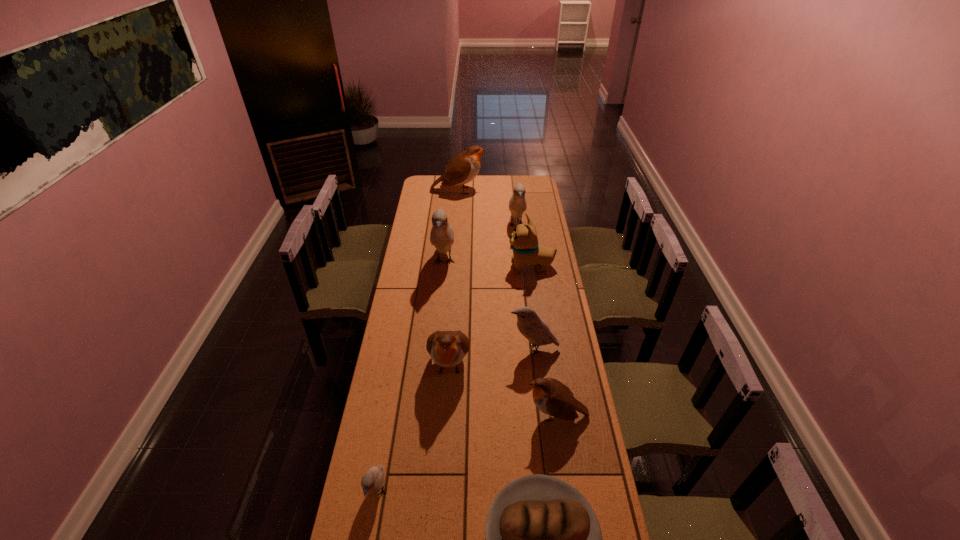
The image size is (960, 540). In the image, there is a desktop. What are the coordinates of `free space at the right edge` in the screenshot? It's located at (546, 361).

At what (x,y) coordinates should I click in order to perform the action: click on free space between the farthest brown bird and the nearest brown bird. Please return your answer as a coordinate pair (x, y). Looking at the image, I should click on (507, 303).

The width and height of the screenshot is (960, 540). Identify the location of unoccupied area between the third farthest white bird and the farthest object. (496, 269).

Identify the location of vacant region between the puppy and the farthest object. The width and height of the screenshot is (960, 540). (494, 228).

Identify the location of free space between the puppy and the nearest white bird. (454, 380).

Locate an element on the screen. Image resolution: width=960 pixels, height=540 pixels. blank region between the puppy and the nearest white bird is located at coordinates (454, 380).

Find the location of a particular element. free spot between the third farthest white bird and the eighth nearest object is located at coordinates (525, 287).

This screenshot has height=540, width=960. In order to click on object that is the fifth nearest to the second nearest white bird in this screenshot , I will do `click(543, 539)`.

Locate an element on the screen. This screenshot has height=540, width=960. object that is the seventh closest to the second smallest white bird is located at coordinates (517, 205).

Identify which bird is located as the third nearest to the second smallest brown bird. Please provide its 2D coordinates. Your answer should be formatted as a tuple, i.e. [(x, y)], where the tuple contains the x and y coordinates of a point satisfying the conditions above.

[(372, 481)]